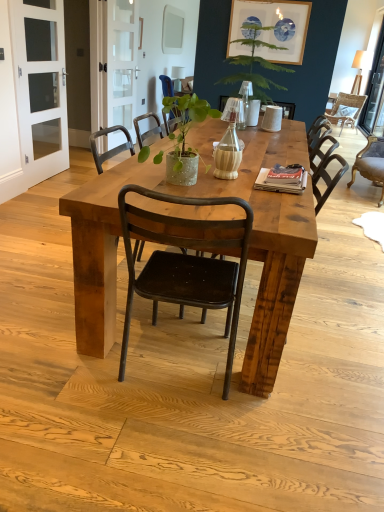
Question: In the image, is white glass screen door at left, the 1th screen door in the left-to-right sequence, on the left side or the right side of matte beige cup at center?

Choices:
 (A) left
 (B) right

Answer: (A)

Question: In terms of height, does white glass screen door at left, the first screen door from the front, look taller or shorter compared to matte beige cup at center?

Choices:
 (A) tall
 (B) short

Answer: (A)

Question: Estimate the real-world distances between objects in this image. Which object is farther from the matte beige cup at center?

Choices:
 (A) speckled concrete pot at center, which appears as the second houseplant when viewed from the back
 (B) matte blue and white circular prints at upper center
 (C) metallic black chair at center, which appears as the second chair when viewed from the back
 (D) clear glass door at upper center, which ranks as the first screen door in back-to-front order
 (E) brown leather chair at right, which appears as the third chair when viewed from the back

Answer: (E)

Question: Which object is positioned farthest from the clear glass vase at center?

Choices:
 (A) matte beige cup at center
 (B) metallic black chair at center, the 4th chair positioned from the right
 (C) clear glass door at upper center, marked as the first screen door in a right-to-left arrangement
 (D) speckled concrete pot at center, the 1th houseplant when ordered from front to back
 (E) woven rattan chair at upper right, the first chair when ordered from back to front

Answer: (E)